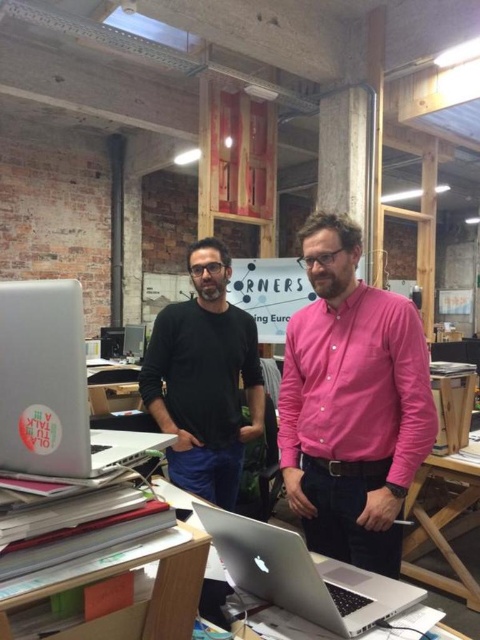
You are organizing a charity event and need to decide which item to place on a 1.2 meter wide stage. The pink cotton shirt at center and the wooden table at center are available. Which item can fit better on the stage based on their sizes?

The pink cotton shirt at center has a smaller size compared to wooden table at center, so it can fit better on the 1.2 meter wide stage.

You are standing in the office and want to place a small potted plant between the two points labeled point (428, 435) and point (420, 502). Which point should the plant be closer to in order to be nearer to the viewer?

The plant should be placed closer to point (428, 435) because it is closer to the viewer than point (420, 502).

You are a photographer setting up for a portrait session in this office. You have a camera and a silver metallic laptop at lower left. To ensure the laptop stays visible in the frame, what is the minimum distance you need to maintain between the camera and the laptop?

The minimum distance you need to maintain between the camera and the silver metallic laptop at lower left is 28.58 inches to ensure it stays visible in the frame.